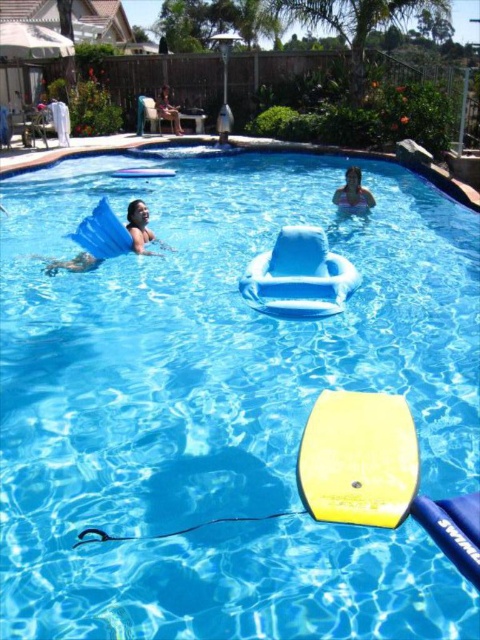
You are a photographer trying to capture the smooth skin at upper center and the matte blue floatie at upper left in the same frame. Based on their heights, which object would appear closer to the camera in the photo?

The smooth skin at upper center has a lesser height compared to the matte blue floatie at upper left, so it would appear closer to the camera in the photo.

You are a parent supervising children at the pool. You need to choose a larger floating toy for a child who is afraid of sinking. Which one between the yellow foam paddle at center and the matte blue floatie at upper left should you choose?

The matte blue floatie at upper left is larger than the yellow foam paddle at center, so it would provide better buoyancy and stability for a child who is afraid of sinking.